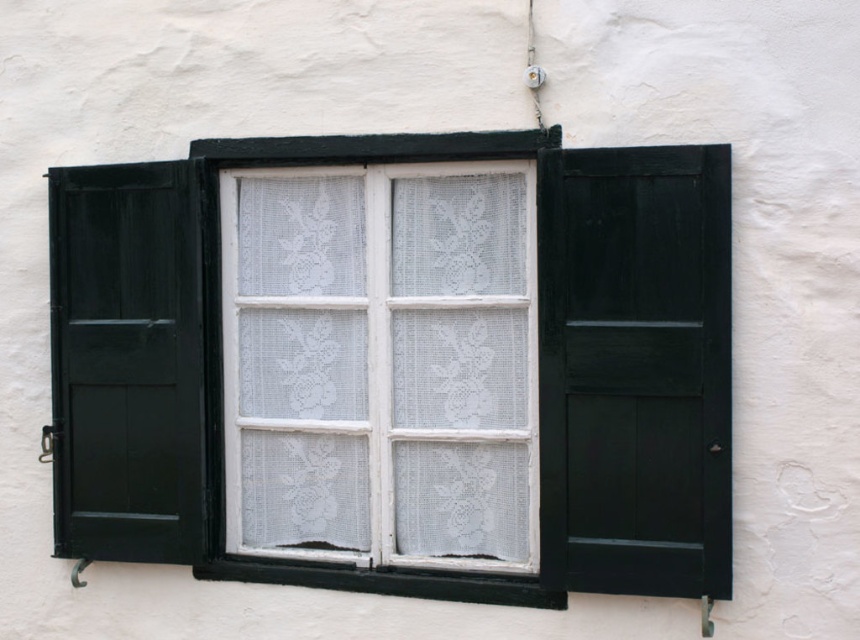
Question: Is matte black shutter at right bigger than black rubber window sill at lower center?

Choices:
 (A) no
 (B) yes

Answer: (B)

Question: Which object appears farthest from the camera in this image?

Choices:
 (A) white lace curtain at center
 (B) matte black shutter at right

Answer: (A)

Question: Can you confirm if white painted wood window frame at center is positioned below white lace curtain at center?

Choices:
 (A) yes
 (B) no

Answer: (A)

Question: Among these points, which one is farthest from the camera?

Choices:
 (A) (290, 564)
 (B) (510, 444)
 (C) (611, 314)

Answer: (A)

Question: Is matte black shutter at right closer to the viewer compared to black rubber window sill at lower center?

Choices:
 (A) no
 (B) yes

Answer: (B)

Question: Which of the following is the closest to the observer?

Choices:
 (A) (685, 584)
 (B) (244, 561)
 (C) (69, 490)

Answer: (A)